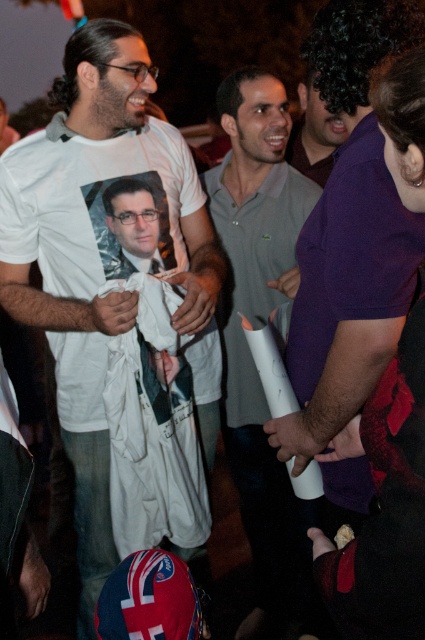
You are standing in the crowd at this event and want to move from the location of point (107, 474) to point (255, 570). Considering the spatial relationship between these two points, which direction should you move to get closer to your destination?

Since point (107, 474) is closer to the viewer than point (255, 570), you should move backward to reach your destination because point (255, 570) is farther away from your current position.